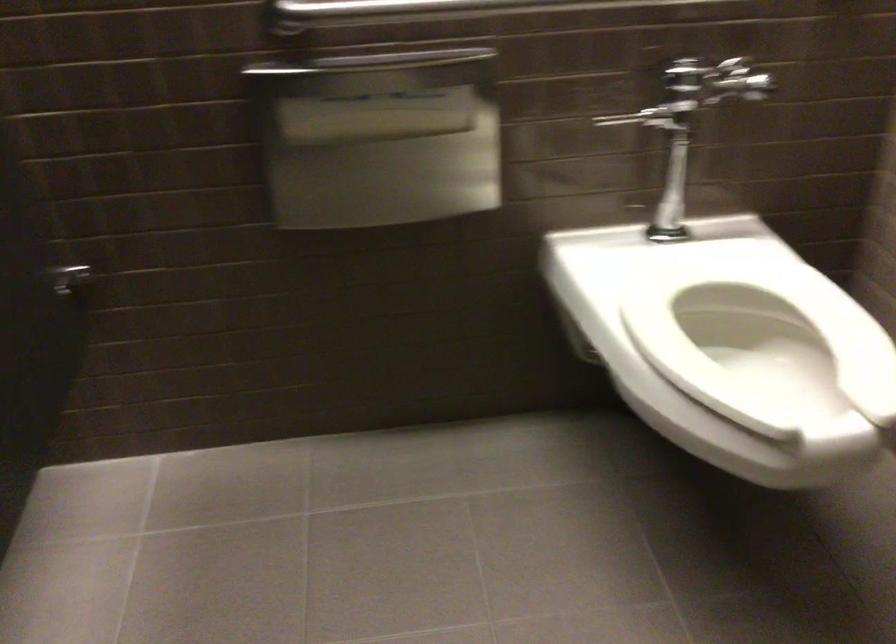
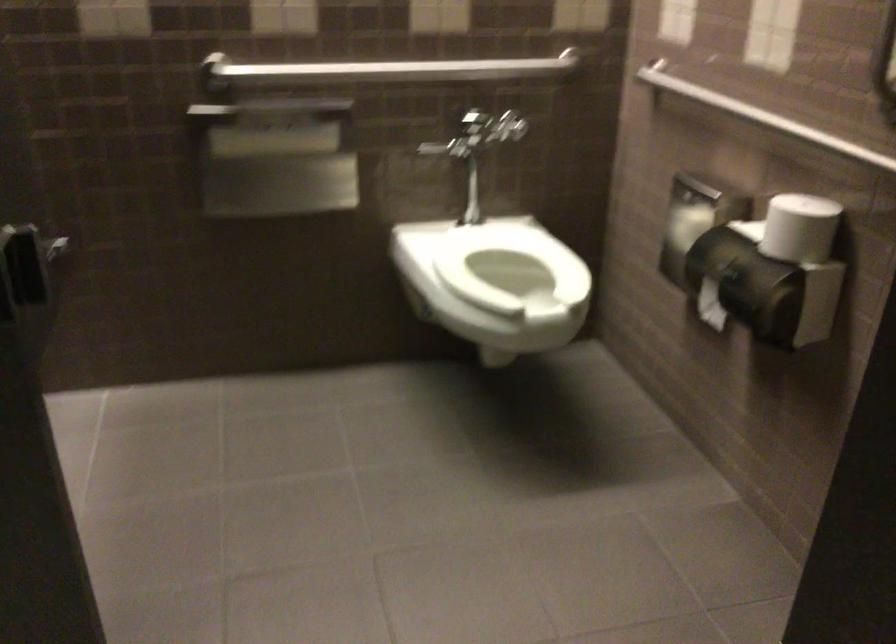
Where in the second image is the point corresponding to pixel 377 122 from the first image?

(273, 143)